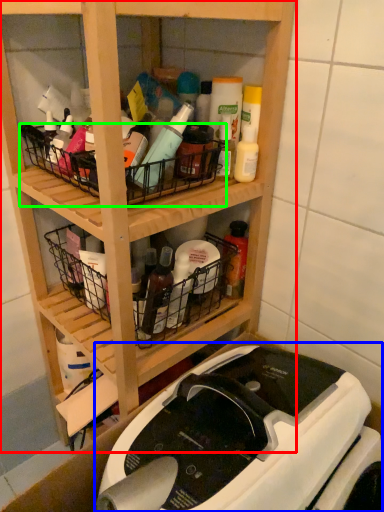
Question: Which is farther away from shelf (highlighted by a red box)? sewing machine (highlighted by a blue box) or basket (highlighted by a green box)?

Choices:
 (A) sewing machine
 (B) basket

Answer: (A)